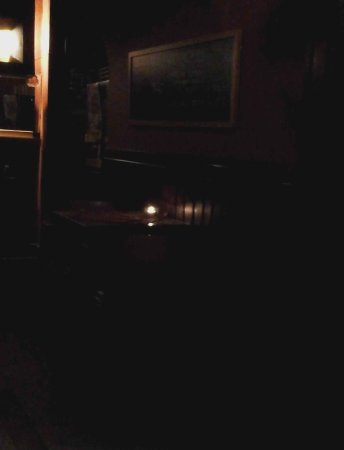
What are the coordinates of `light` in the screenshot? It's located at (153, 209), (150, 223), (12, 48).